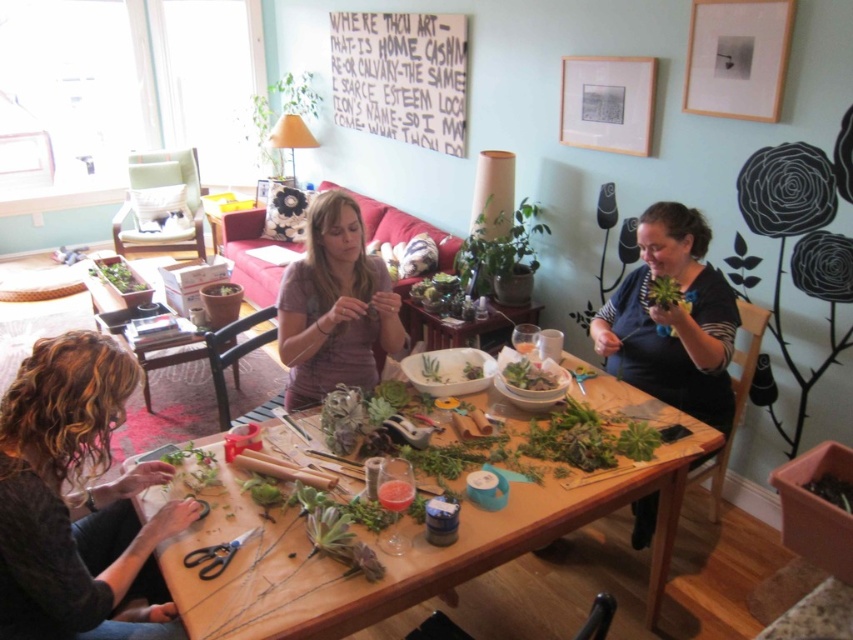
Question: Considering the real-world distances, which object is farthest from the dark blue sweater at right?

Choices:
 (A) matte pink shirt at center
 (B) green succulent at center
 (C) green leafy salad at center

Answer: (B)

Question: Does dark blue sweater at right have a greater width compared to green leafy salad at center?

Choices:
 (A) no
 (B) yes

Answer: (B)

Question: Does green leafy salad at center appear over black plastic scissors at lower left?

Choices:
 (A) yes
 (B) no

Answer: (A)

Question: Does dark blue sweater at right have a lesser width compared to green leafy salad at center?

Choices:
 (A) no
 (B) yes

Answer: (A)

Question: Which of the following is the farthest from the observer?

Choices:
 (A) (77, 340)
 (B) (236, 516)
 (C) (688, 301)

Answer: (C)

Question: Which point is closer to the camera taking this photo?

Choices:
 (A) (207, 557)
 (B) (679, 244)
 (C) (347, 269)

Answer: (A)